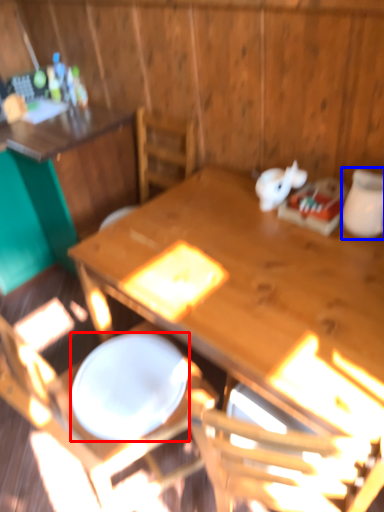
Question: Which object appears closest to the camera in this image, plate (highlighted by a red box) or tableware (highlighted by a blue box)?

Choices:
 (A) plate
 (B) tableware

Answer: (A)